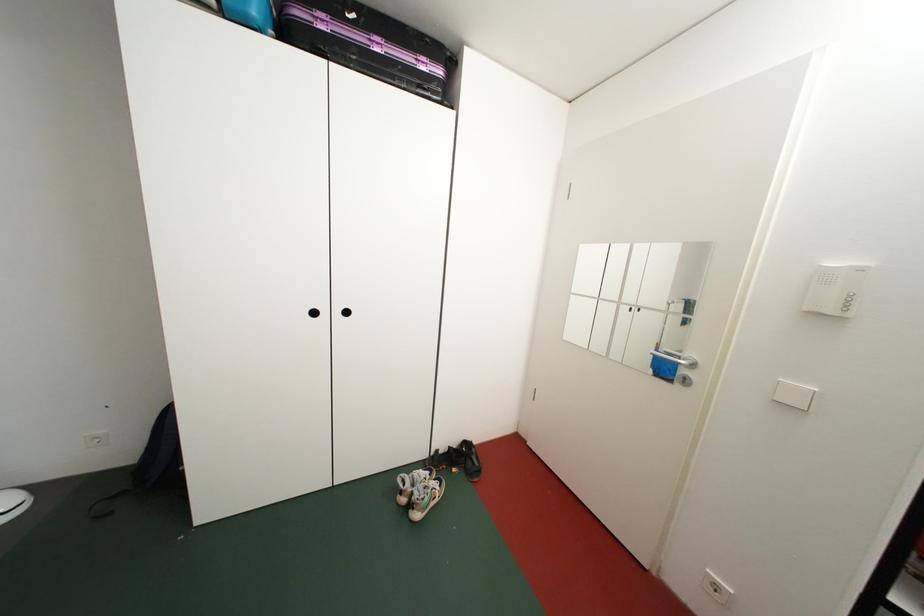
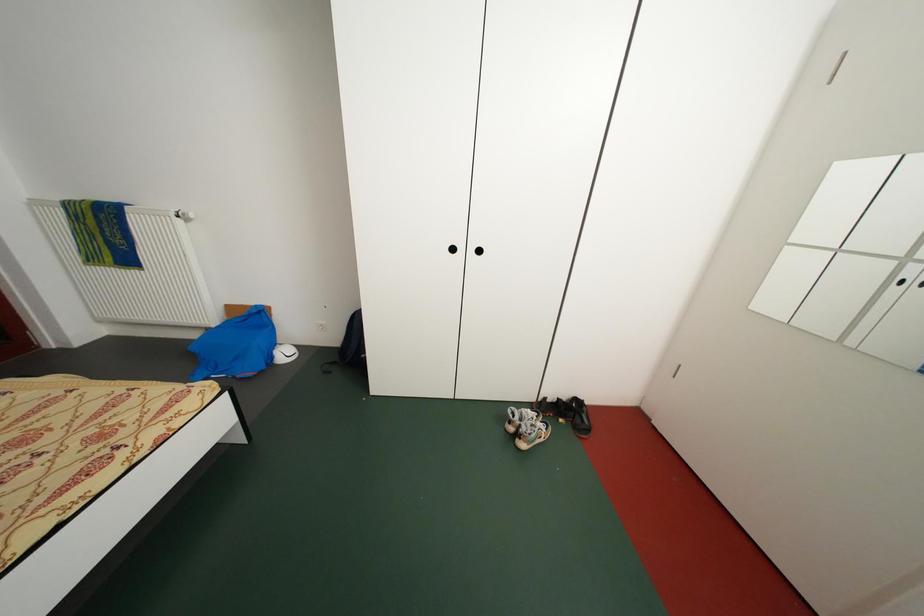
Question: How did the camera likely rotate?

Choices:
 (A) Left
 (B) Right
 (C) Up
 (D) Down

Answer: (A)